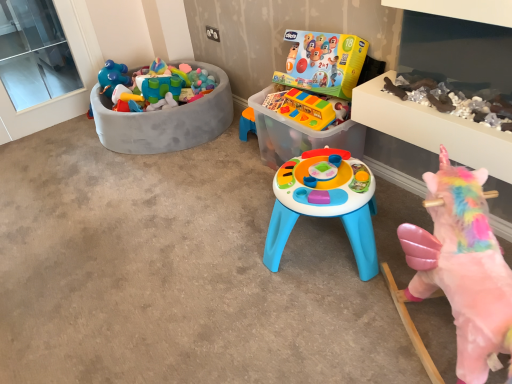
Where is `vacant space underneath transparent glass window at upper left (from a real-world perspective)`? vacant space underneath transparent glass window at upper left (from a real-world perspective) is located at coordinates (76, 117).